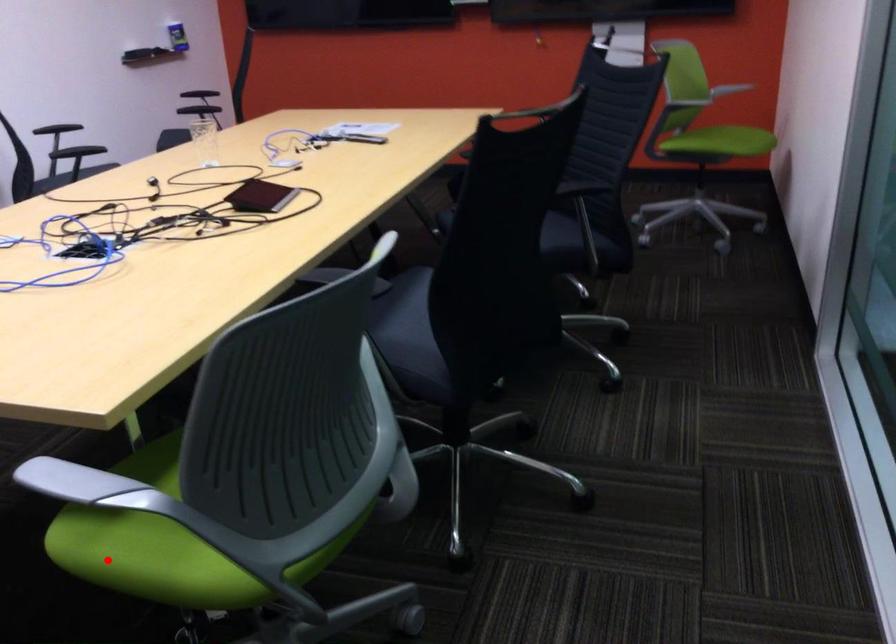
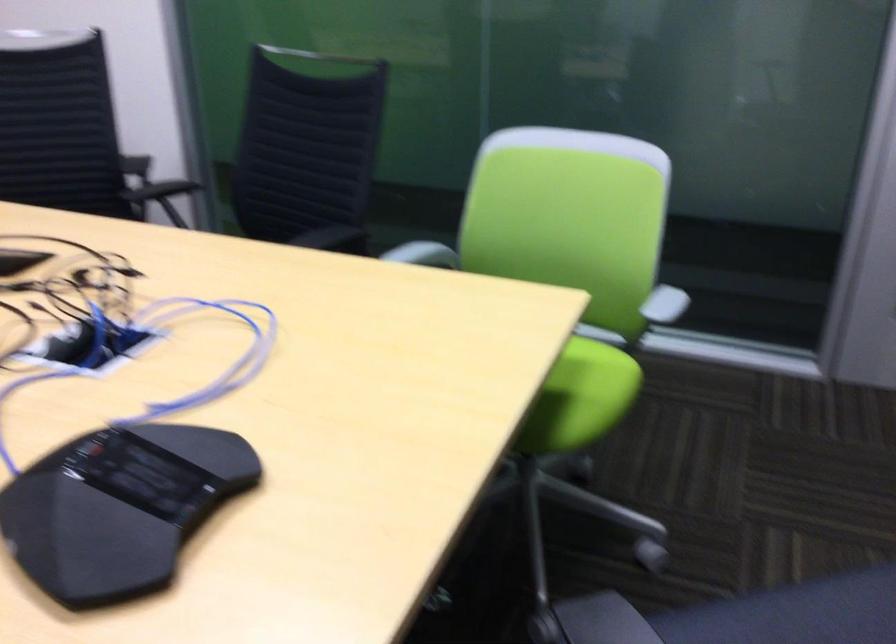
The point at the highlighted location is marked in the first image. Where is the corresponding point in the second image?

(590, 392)